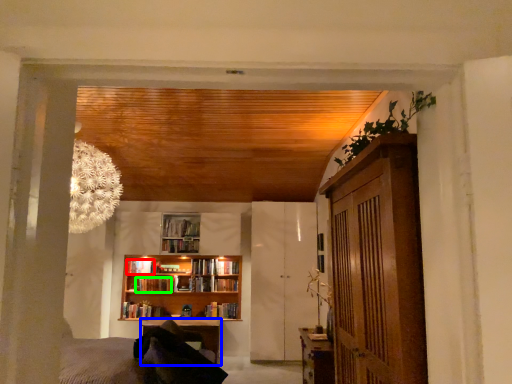
Question: Which is nearer to the book (highlighted by a red box)? table (highlighted by a blue box) or book (highlighted by a green box).

Choices:
 (A) table
 (B) book

Answer: (B)